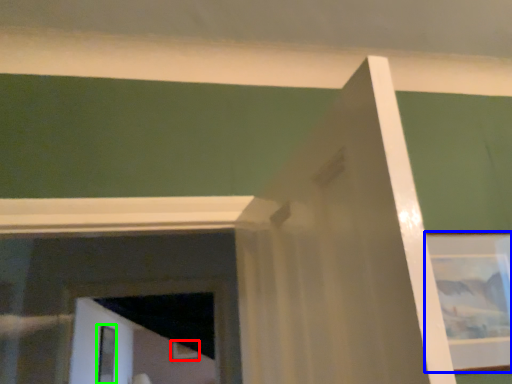
Question: Which object is positioned farthest from picture frame (highlighted by a red box)? Select from picture frame (highlighted by a blue box) and screen door (highlighted by a green box).

Choices:
 (A) picture frame
 (B) screen door

Answer: (A)